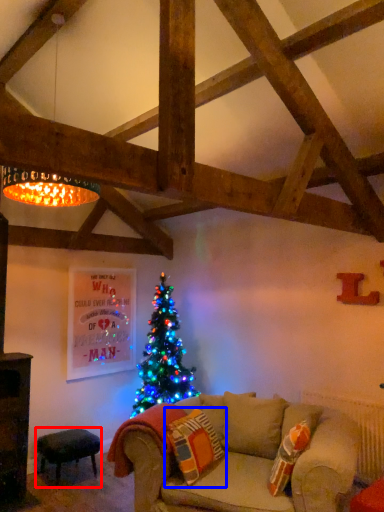
Question: Which point is further to the camera, stool (highlighted by a red box) or pillow (highlighted by a blue box)?

Choices:
 (A) stool
 (B) pillow

Answer: (A)